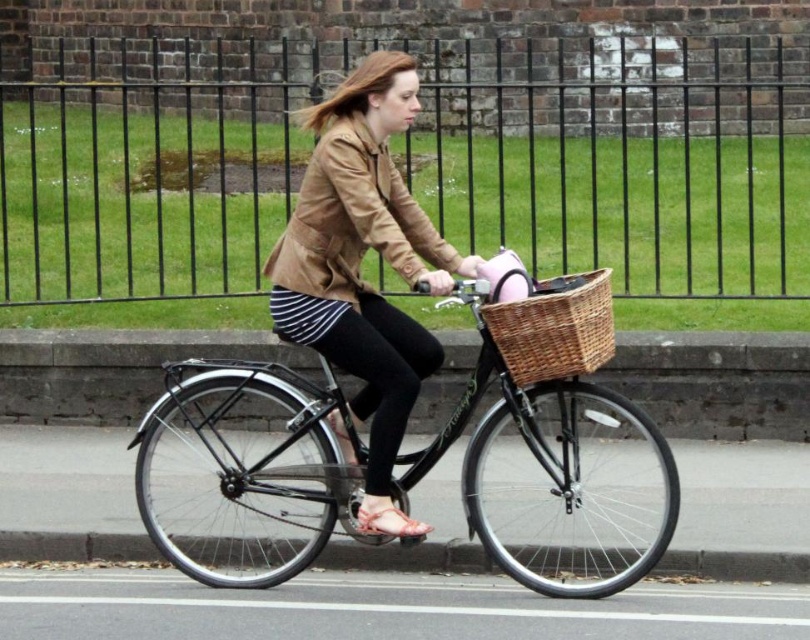
Question: Does black matte bicycle at center have a larger size compared to pink fabric helmet at center?

Choices:
 (A) yes
 (B) no

Answer: (A)

Question: Which object is positioned closest to the black iron fence at upper center?

Choices:
 (A) woven brown basket at center
 (B) matte brown leather jacket at center
 (C) black matte bicycle at center
 (D) pink fabric helmet at center

Answer: (C)

Question: Where is black iron fence at upper center located in relation to tan leather jacket at center in the image?

Choices:
 (A) above
 (B) below

Answer: (A)

Question: Based on their relative distances, which object is farther from the pink fabric helmet at center?

Choices:
 (A) matte brown leather jacket at center
 (B) black matte bicycle at center
 (C) woven brown basket at center

Answer: (B)

Question: Does matte brown leather jacket at center appear on the left side of pink fabric helmet at center?

Choices:
 (A) no
 (B) yes

Answer: (B)

Question: Which point appears closest to the camera in this image?

Choices:
 (A) (600, 310)
 (B) (288, 460)

Answer: (A)